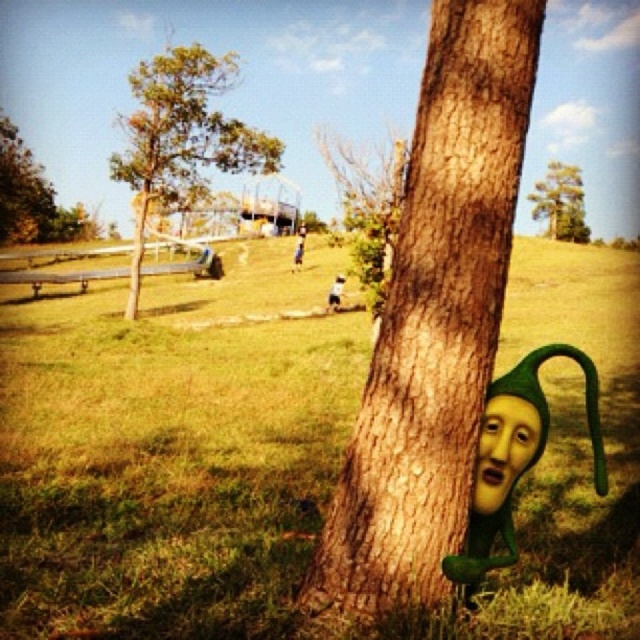
Which is behind, point (10, 188) or point (579, 204)?

The point (579, 204) is behind.

Does point (10, 220) lie in front of point (573, 172)?

Yes.

Image resolution: width=640 pixels, height=640 pixels. In order to click on green matte tree at upper left in this screenshot , I will do `click(20, 189)`.

Is green matte mask at lower right positioned behind green matte tree at upper center?

No, green matte mask at lower right is closer to the viewer.

Does point (477, 477) lie behind point (563, 212)?

No, (477, 477) is in front of (563, 212).

Find the location of `green matte mask at lower right`. green matte mask at lower right is located at coordinates (502, 449).

Can you confirm if brown rough tree trunk at center is positioned above green matte mask at lower right?

Correct, brown rough tree trunk at center is located above green matte mask at lower right.

Does brown rough tree trunk at center appear on the left side of green matte mask at lower right?

Correct, you'll find brown rough tree trunk at center to the left of green matte mask at lower right.

This screenshot has height=640, width=640. What are the coordinates of `brown rough tree trunk at center` in the screenshot? It's located at (435, 317).